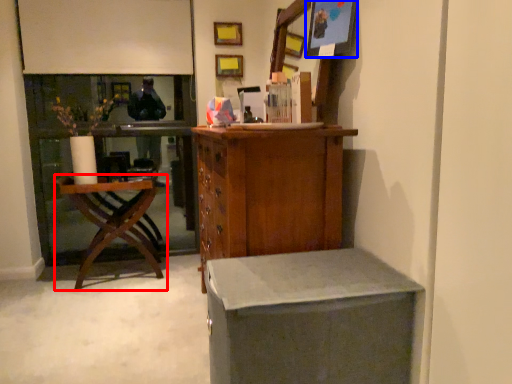
Question: Which object appears closest to the camera in this image, chair (highlighted by a red box) or picture frame (highlighted by a blue box)?

Choices:
 (A) chair
 (B) picture frame

Answer: (B)